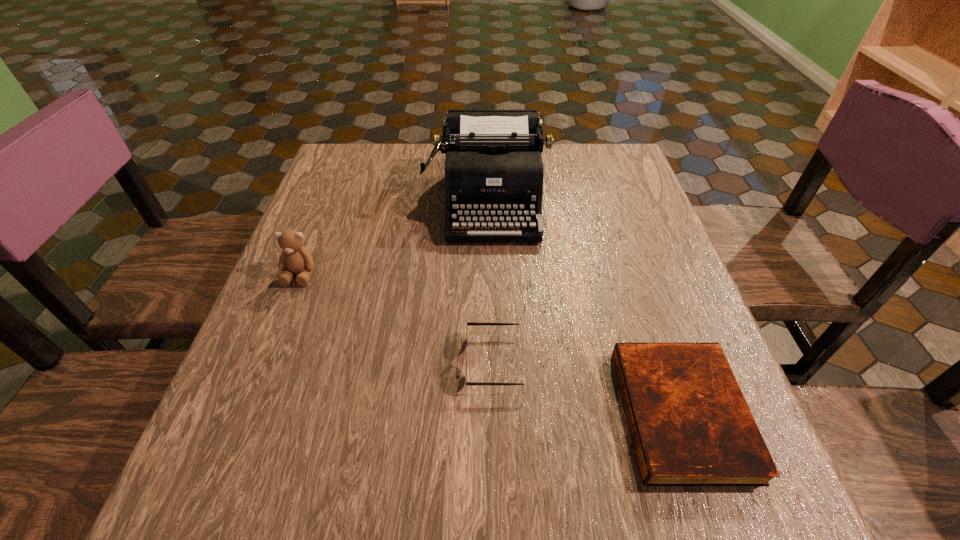
You are a GUI agent. You are given a task and a screenshot of the screen. Output one action in this format:
    pyautogui.click(x=<x>, y=<y>)
    Task: Click on the free space at the far edge
    This screenshot has height=540, width=960.
    Given the screenshot: What is the action you would take?
    pyautogui.click(x=558, y=152)

The image size is (960, 540). In order to click on vacant area at the near edge in this screenshot , I will do `click(600, 518)`.

In the image, there is a desktop. Where is `vacant space at the left edge`? The height and width of the screenshot is (540, 960). vacant space at the left edge is located at coordinates (294, 283).

Find the location of `free space at the right edge of the desktop`. free space at the right edge of the desktop is located at coordinates (604, 236).

Locate an element on the screen. Image resolution: width=960 pixels, height=540 pixels. free region at the far left corner is located at coordinates (332, 157).

Identify the location of blank area at the near left corner. This screenshot has width=960, height=540. coord(295,498).

You are a GUI agent. You are given a task and a screenshot of the screen. Output one action in this format:
    pyautogui.click(x=<x>, y=<y>)
    Task: Click on the free space at the far right corner
    
    Given the screenshot: What is the action you would take?
    pyautogui.click(x=610, y=183)

Identify the location of vacant point located between the teddy bear and the sunglasses. This screenshot has width=960, height=540. (396, 318).

This screenshot has height=540, width=960. I want to click on free spot between the sunglasses and the farthest object, so click(x=492, y=281).

This screenshot has width=960, height=540. Identify the location of free space between the sunglasses and the Bible. (588, 387).